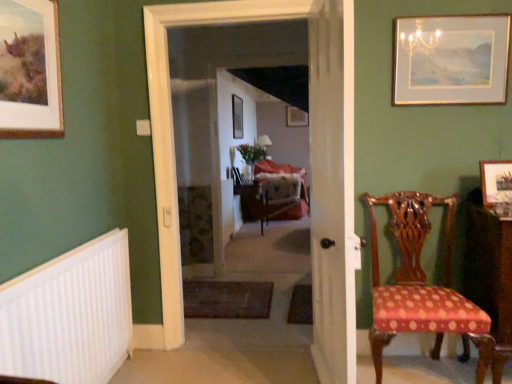
What do you see at coordinates (421, 284) in the screenshot? I see `polka dot fabric chair at right` at bounding box center [421, 284].

At what (x,y) coordinates should I click in order to perform the action: click on wooden picture frame at center, the 1th picture frame positioned from the back. Please return your answer as a coordinate pair (x, y). This screenshot has width=512, height=384. Looking at the image, I should click on (296, 117).

What do you see at coordinates (451, 59) in the screenshot? I see `gold-framed picture at upper right, positioned as the 3th picture frame in back-to-front order` at bounding box center [451, 59].

The image size is (512, 384). Find the location of `white wooden door at center`. white wooden door at center is located at coordinates click(x=332, y=188).

Considering the sizes of wooden picture frame at upper left, marked as the 5th picture frame in a right-to-left arrangement, and carpeted floor at center, the 1th corridor positioned from the front, in the image, is wooden picture frame at upper left, marked as the 5th picture frame in a right-to-left arrangement, taller or shorter than carpeted floor at center, the 1th corridor positioned from the front,?

wooden picture frame at upper left, marked as the 5th picture frame in a right-to-left arrangement, is shorter than carpeted floor at center, the 1th corridor positioned from the front.

Looking at this image, is wooden picture frame at upper left, which is the first picture frame in front-to-back order, positioned with its back to carpeted floor at center, the 1th corridor positioned from the front?

No, wooden picture frame at upper left, which is the first picture frame in front-to-back order, is not facing away from carpeted floor at center, the 1th corridor positioned from the front.

Is wooden picture frame at upper left, marked as the 5th picture frame in a right-to-left arrangement, not within carpeted floor at center, the 1th corridor positioned from the front?

Yes, wooden picture frame at upper left, marked as the 5th picture frame in a right-to-left arrangement, is outside of carpeted floor at center, the 1th corridor positioned from the front.

This screenshot has height=384, width=512. Find the location of `corridor that is the 1st one when counting rightward from the wooden picture frame at upper left, marked as the 5th picture frame in a right-to-left arrangement`. corridor that is the 1st one when counting rightward from the wooden picture frame at upper left, marked as the 5th picture frame in a right-to-left arrangement is located at coordinates (220, 121).

Is velvet upholstered swivel chair at center at the right side of wooden picture frame at right, acting as the fourth picture frame starting from the back?

Incorrect, velvet upholstered swivel chair at center is not on the right side of wooden picture frame at right, acting as the fourth picture frame starting from the back.

Is velvet upholstered swivel chair at center bigger or smaller than wooden picture frame at right, positioned as the first picture frame in right-to-left order?

velvet upholstered swivel chair at center is bigger than wooden picture frame at right, positioned as the first picture frame in right-to-left order.

Is velvet upholstered swivel chair at center positioned with its back to wooden picture frame at right, acting as the fifth picture frame starting from the left?

No.

Which object is further away from the camera, velvet upholstered swivel chair at center or wooden picture frame at right, placed as the second picture frame when sorted from front to back?

velvet upholstered swivel chair at center is further away from the camera.

Can you confirm if wooden picture frame at center, the 5th picture frame in the front-to-back sequence, is smaller than carpeted floor at center, the 1th corridor positioned from the front?

Yes.

The image size is (512, 384). There is a wooden picture frame at center, which ranks as the 3th picture frame in right-to-left order. Identify the location of the 1st corridor below it (from a real-world perspective). (220, 121).

Which of these two, wooden picture frame at center, which ranks as the 3th picture frame in right-to-left order, or carpeted floor at center, which is the 2th corridor from back to front, is wider?

carpeted floor at center, which is the 2th corridor from back to front.

Is point (289, 108) positioned after point (198, 161)?

Yes, it is behind point (198, 161).

Is velvet upholstered swivel chair at center surrounded by wooden picture frame at right, acting as the fifth picture frame starting from the left?

Definitely not — velvet upholstered swivel chair at center is not inside wooden picture frame at right, acting as the fifth picture frame starting from the left.

Does point (498, 187) lie behind point (281, 212)?

No.

The image size is (512, 384). What are the coordinates of `swivel chair lying on the left of wooden picture frame at right, acting as the fourth picture frame starting from the back` in the screenshot? It's located at (286, 173).

Between wooden picture frame at right, acting as the fifth picture frame starting from the left, and velvet upholstered swivel chair at center, which one has larger size?

velvet upholstered swivel chair at center.

Are velvet upholstered swivel chair at center and white plastic radiator at lower left beside each other?

There is a gap between velvet upholstered swivel chair at center and white plastic radiator at lower left.

Considering the relative sizes of velvet upholstered swivel chair at center and white plastic radiator at lower left in the image provided, is velvet upholstered swivel chair at center bigger than white plastic radiator at lower left?

Indeed, velvet upholstered swivel chair at center has a larger size compared to white plastic radiator at lower left.

Could you tell me if velvet upholstered swivel chair at center is facing white plastic radiator at lower left?

No, velvet upholstered swivel chair at center is not oriented towards white plastic radiator at lower left.

From the image's perspective, would you say velvet upholstered swivel chair at center is positioned over white plastic radiator at lower left?

Yes, from the image's perspective, velvet upholstered swivel chair at center is on top of white plastic radiator at lower left.

From the image's perspective, is wooden picture frame at right, acting as the fifth picture frame starting from the left, positioned above or below white wooden door at center?

wooden picture frame at right, acting as the fifth picture frame starting from the left, is above white wooden door at center.

Does wooden picture frame at right, acting as the fourth picture frame starting from the back, appear on the right side of white wooden door at center?

Indeed, wooden picture frame at right, acting as the fourth picture frame starting from the back, is positioned on the right side of white wooden door at center.

Does wooden picture frame at right, positioned as the first picture frame in right-to-left order, have a greater width compared to white wooden door at center?

Answer: Incorrect, the width of wooden picture frame at right, positioned as the first picture frame in right-to-left order, does not surpass that of white wooden door at center.

Does wooden picture frame at right, acting as the fifth picture frame starting from the left, turn towards white wooden door at center?

No, wooden picture frame at right, acting as the fifth picture frame starting from the left, is not facing towards white wooden door at center.

How far apart are wooden picture frame at center, the second picture frame in the left-to-right sequence, and carpeted floor at center, which is the 2th corridor from back to front?

wooden picture frame at center, the second picture frame in the left-to-right sequence, is 2.24 meters away from carpeted floor at center, which is the 2th corridor from back to front.

Would you say wooden picture frame at center, the second picture frame in the left-to-right sequence, is inside or outside carpeted floor at center, which is the 2th corridor from back to front?

wooden picture frame at center, the second picture frame in the left-to-right sequence, is spatially situated outside carpeted floor at center, which is the 2th corridor from back to front.

Is carpeted floor at center, the 1th corridor positioned from the front, at the back of wooden picture frame at center, which is the second picture frame from back to front?

wooden picture frame at center, which is the second picture frame from back to front, does not have its back to carpeted floor at center, the 1th corridor positioned from the front.

Starting from the wooden picture frame at center, which appears as the 4th picture frame when viewed from the right, which corridor is the 2nd one in front? Please provide its 2D coordinates.

[(220, 121)]

From the image's perspective, starting from the carpeted floor at center, the 1th corridor positioned from the front, which picture frame is the 1st one above? Please provide its 2D coordinates.

[(30, 70)]

Locate an element on the screen. picture frame below the velvet upholstered swivel chair at center (from the image's perspective) is located at coordinates (496, 181).

Based on their spatial positions, is wooden picture frame at center, the third picture frame from the left, or white plastic radiator at lower left further from gold-framed picture at upper right, marked as the second picture frame in a right-to-left arrangement?

wooden picture frame at center, the third picture frame from the left, lies further to gold-framed picture at upper right, marked as the second picture frame in a right-to-left arrangement, than the other object.

Consider the image. Looking at the image, which one is located closer to wooden picture frame at center, the 5th picture frame in the front-to-back sequence, wooden picture frame at center, which appears as the 4th picture frame when viewed from the right, or polka dot fabric chair at right?

Based on the image, wooden picture frame at center, which appears as the 4th picture frame when viewed from the right, appears to be nearer to wooden picture frame at center, the 5th picture frame in the front-to-back sequence.

Estimate the real-world distances between objects in this image. Which object is closer to wooden picture frame at right, acting as the fourth picture frame starting from the back, velvet upholstered swivel chair at center or white wooden door at center?

Based on the image, white wooden door at center appears to be nearer to wooden picture frame at right, acting as the fourth picture frame starting from the back.

Consider the image. Looking at the image, which one is located closer to carpeted floor at center, which is the 2th corridor from back to front, gold-framed picture at upper right, marked as the second picture frame in a right-to-left arrangement, or white plastic radiator at lower left?

The object closer to carpeted floor at center, which is the 2th corridor from back to front, is gold-framed picture at upper right, marked as the second picture frame in a right-to-left arrangement.

Looking at the image, which one is located further to velvet upholstered swivel chair at center, floral-patterned fabric at center, the second corridor viewed from the front, or polka dot fabric chair at right?

polka dot fabric chair at right.

Based on their spatial positions, is carpeted floor at center, which is the 2th corridor from back to front, or polka dot fabric chair at right closer to wooden picture frame at center, which appears as the 4th picture frame when viewed from the right?

Based on the image, carpeted floor at center, which is the 2th corridor from back to front, appears to be nearer to wooden picture frame at center, which appears as the 4th picture frame when viewed from the right.

Looking at the image, which one is located further to gold-framed picture at upper right, marked as the second picture frame in a right-to-left arrangement, wooden picture frame at upper left, positioned as the 5th picture frame in back-to-front order, or white plastic radiator at lower left?

white plastic radiator at lower left lies further to gold-framed picture at upper right, marked as the second picture frame in a right-to-left arrangement, than the other object.

From the image, which object appears to be nearer to wooden picture frame at right, acting as the fifth picture frame starting from the left, gold-framed picture at upper right, the fourth picture frame from the left, or floral-patterned fabric at center, the first corridor from the back?

The object closer to wooden picture frame at right, acting as the fifth picture frame starting from the left, is gold-framed picture at upper right, the fourth picture frame from the left.

You are a GUI agent. You are given a task and a screenshot of the screen. Output one action in this format:
    pyautogui.click(x=<x>, y=<y>)
    Task: Click on the picture frame positioned between carpeted floor at center, which is the 2th corridor from back to front, and wooden picture frame at center, the 1th picture frame positioned from the back, from near to far
    Image resolution: width=512 pixels, height=384 pixels.
    Given the screenshot: What is the action you would take?
    pos(237,117)

At what (x,y) coordinates should I click in order to perform the action: click on door situated between white plastic radiator at lower left and wooden picture frame at right, positioned as the first picture frame in right-to-left order, from left to right. Please return your answer as a coordinate pair (x, y). The height and width of the screenshot is (384, 512). Looking at the image, I should click on (332, 188).

At what (x,y) coordinates should I click in order to perform the action: click on chair between white plastic radiator at lower left and velvet upholstered swivel chair at center along the z-axis. Please return your answer as a coordinate pair (x, y). Looking at the image, I should click on (421, 284).

Locate an element on the screen. swivel chair positioned between white plastic radiator at lower left and wooden picture frame at center, the 1th picture frame positioned from the back, from near to far is located at coordinates (286, 173).